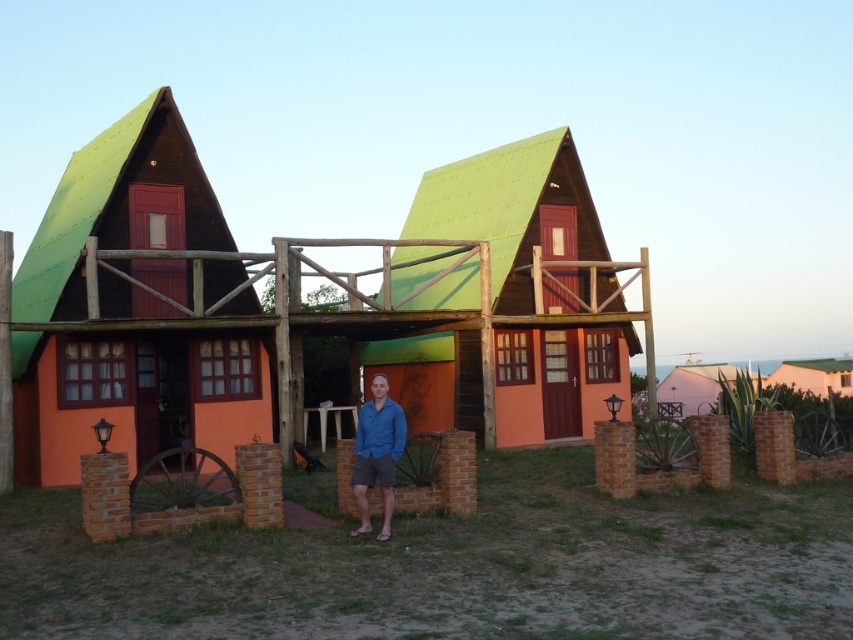
You are standing at the point marked by the coordinate point (376, 452), which corresponds to the blue cotton shirt at center. If you turn to your right, which cabin will you face first? The cabin on the left or the one on the right?

The cabin on the left will be faced first when turning right from the blue cotton shirt at center because the point (376, 452) is located between the two cabins, and turning right would direct your gaze towards the cabin on the left side.

You are a photographer trying to capture a photo of the blue cotton shirt at center and the white matte hut at lower right. Which object should you focus on first if you want to ensure both are in the frame without moving the camera?

The blue cotton shirt at center should be focused on first because it is much taller than the white matte hut at lower right, so adjusting focus to the taller object will help ensure both are in frame.